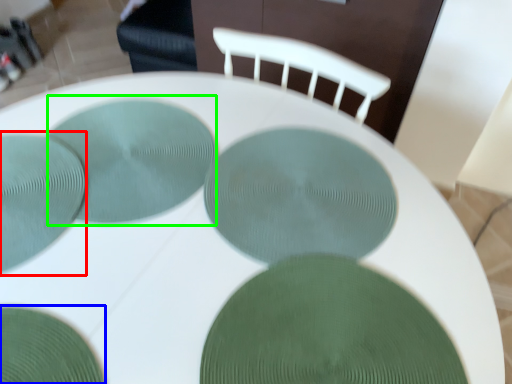
Question: Which object is the farthest from glass plate (highlighted by a red box)? Choose among these: glass plate (highlighted by a blue box) or glass plate (highlighted by a green box).

Choices:
 (A) glass plate
 (B) glass plate

Answer: (A)